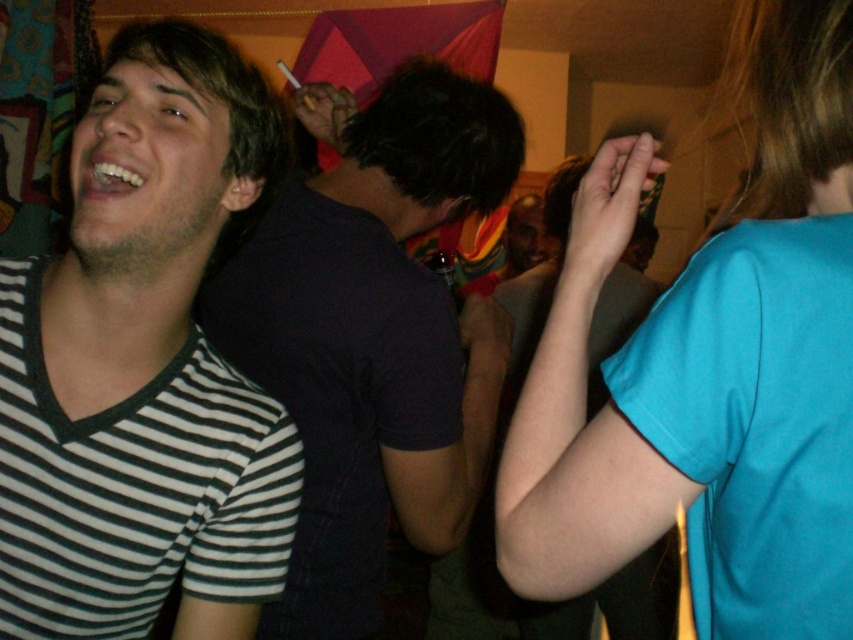
Who is lower down, blue fabric shirt at upper right or matte black shirt at center?

matte black shirt at center

Which is in front, point (556, 292) or point (456, 600)?

Point (556, 292)

Which is behind, point (540, 435) or point (561, 605)?

The point (561, 605) is more distant.

The image size is (853, 640). I want to click on blue fabric shirt at upper right, so click(x=711, y=372).

Who is positioned more to the right, matte black shirt at center or rainbow striped shirt at center?

Positioned to the right is matte black shirt at center.

Can you confirm if matte black shirt at center is positioned above rainbow striped shirt at center?

Actually, matte black shirt at center is below rainbow striped shirt at center.

Where is `matte black shirt at center`? matte black shirt at center is located at coordinates (544, 602).

Which is in front, point (190, 589) or point (595, 340)?

Point (190, 589) is in front.

Can you confirm if black striped shirt at left is taller than matte black shirt at center?

Incorrect, black striped shirt at left's height is not larger of matte black shirt at center's.

Does point (164, 268) come farther from viewer compared to point (471, 636)?

No, (164, 268) is in front of (471, 636).

Where is `black striped shirt at left`? black striped shirt at left is located at coordinates (143, 365).